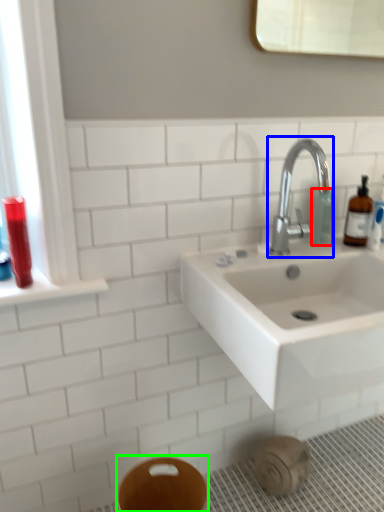
Question: Based on their relative distances, which object is nearer to toiletry (highlighted by a red box)? Choose from tap (highlighted by a blue box) and bidet (highlighted by a green box).

Choices:
 (A) tap
 (B) bidet

Answer: (A)